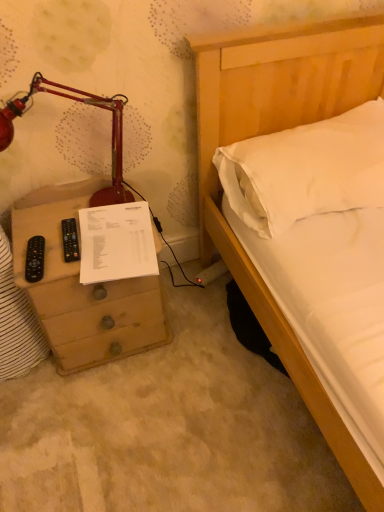
Where is `free location to the left of black plastic remote at left`? This screenshot has height=512, width=384. free location to the left of black plastic remote at left is located at coordinates (31, 237).